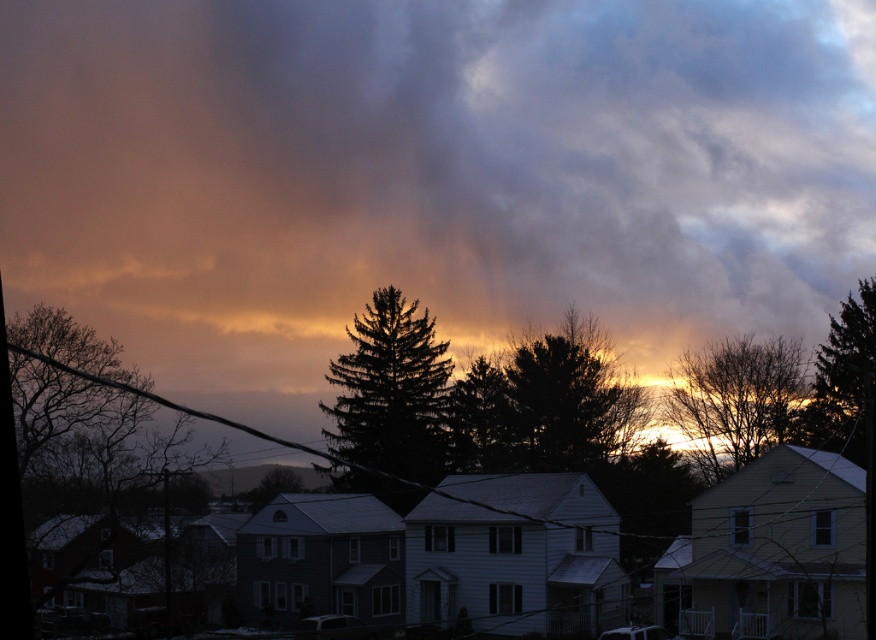
Is dark green textured tree at center to the left of green textured tree at center from the viewer's perspective?

Indeed, dark green textured tree at center is positioned on the left side of green textured tree at center.

What do you see at coordinates (391, 392) in the screenshot? I see `dark green textured tree at center` at bounding box center [391, 392].

The width and height of the screenshot is (876, 640). I want to click on dark green textured tree at center, so click(391, 392).

Consider the image. Can you confirm if bare branches at upper center is positioned above green textured tree at center?

Indeed, bare branches at upper center is positioned over green textured tree at center.

From the picture: Who is more forward, [726,337] or [463,385]?

Positioned in front is point [463,385].

Does point (714, 387) come in front of point (451, 397)?

Yes, it is.

You are a GUI agent. You are given a task and a screenshot of the screen. Output one action in this format:
    pyautogui.click(x=<x>, y=<y>)
    Task: Click on the bare branches at upper center
    The width and height of the screenshot is (876, 640).
    Given the screenshot: What is the action you would take?
    pos(735,400)

Who is positioned more to the left, bare branches at upper center or dark green textured tree at upper right?

dark green textured tree at upper right

Can you confirm if bare branches at upper center is thinner than dark green textured tree at upper right?

No, bare branches at upper center is not thinner than dark green textured tree at upper right.

Between point (790, 417) and point (832, 433), which one is positioned behind?

The point (790, 417) is more distant.

Locate an element on the screen. The image size is (876, 640). bare branches at upper center is located at coordinates (735, 400).